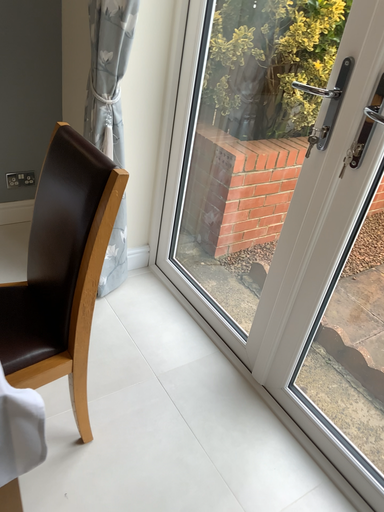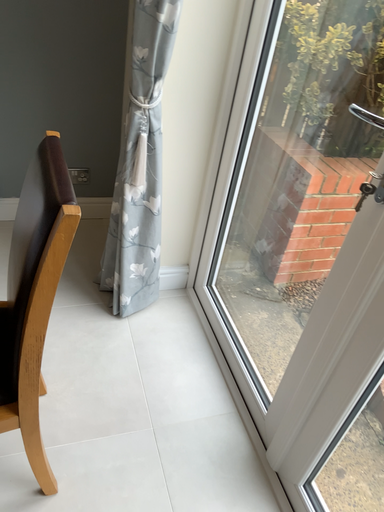
Question: How did the camera likely rotate when shooting the video?

Choices:
 (A) rotated right
 (B) rotated left

Answer: (B)